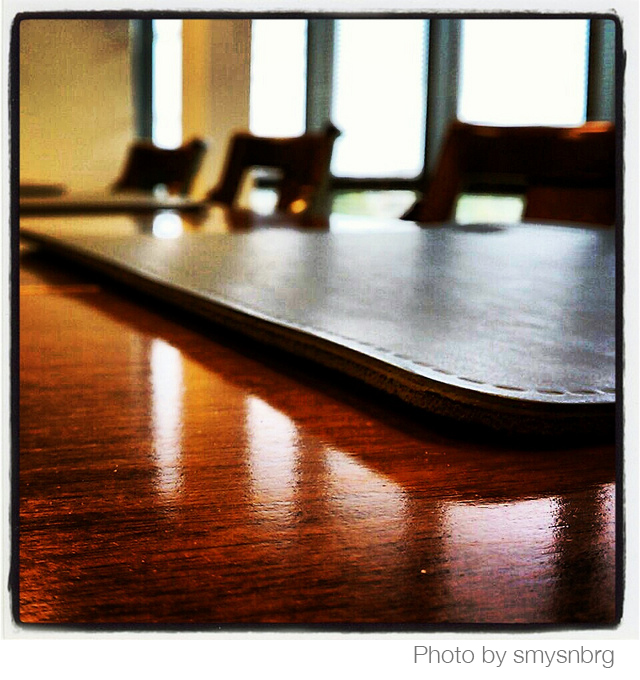
Locate an element on the screen. This screenshot has height=680, width=640. walls is located at coordinates (73, 73).